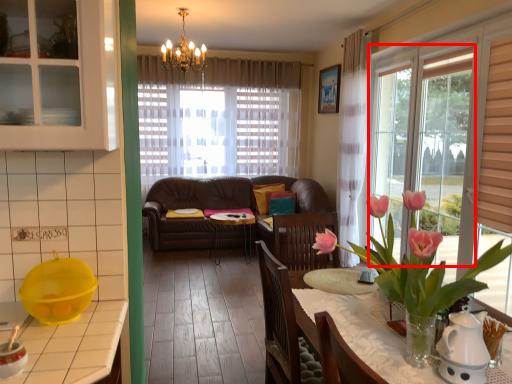
Question: From the image's perspective, considering the relative positions of window (annotated by the red box) and cabinetry in the image provided, where is window (annotated by the red box) located with respect to the staircase?

Choices:
 (A) below
 (B) above

Answer: (A)